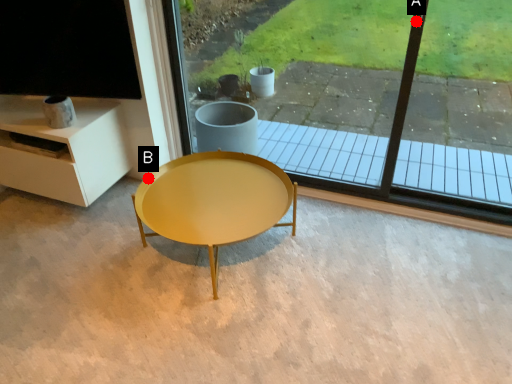
Question: Two points are circled on the image, labeled by A and B beside each circle. Which point is further to the camera?

Choices:
 (A) A is further
 (B) B is further

Answer: (B)